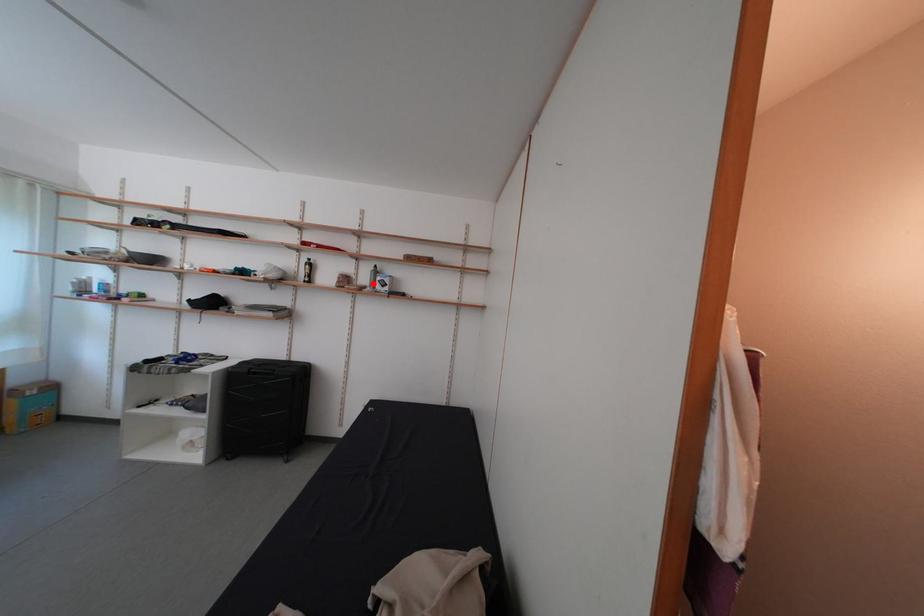
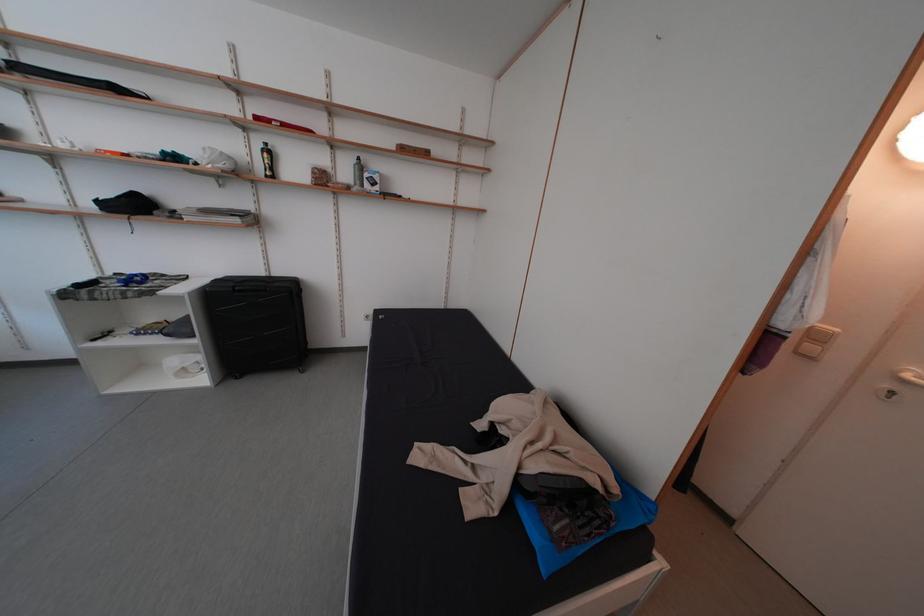
Where in the second image is the point corresponding to the highlighted location from the first image?

(354, 179)